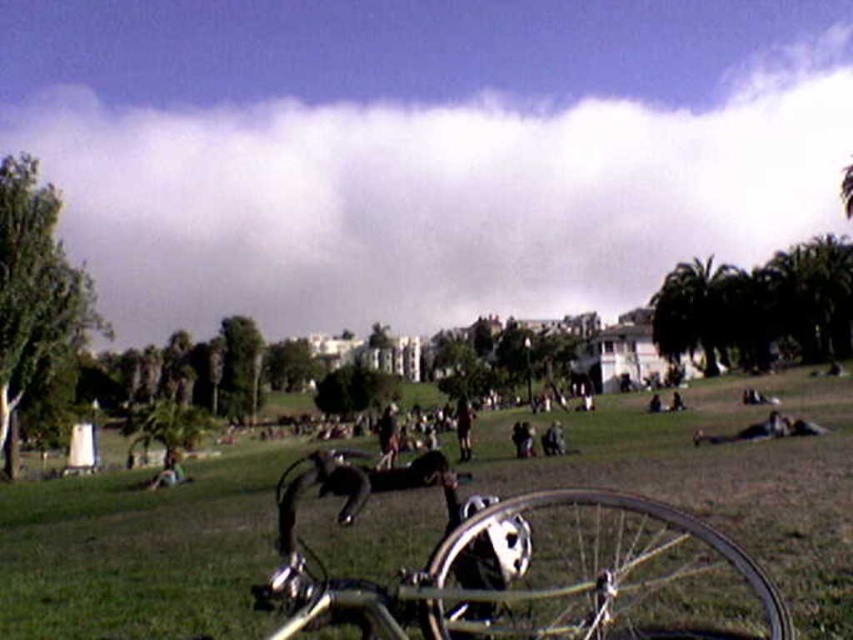
In the scene shown: You are standing at the entrance of the park and see the shiny metallic bicycle at center. If you walk straight ahead, will you reach the bicycle before the trees in the background?

The shiny metallic bicycle at center is located at point [720,477], which is closer to the entrance than the trees in the background. Therefore, you will reach the bicycle before the trees.

You are planning to ride both the shiny metallic bicycle at center and the silver metallic bicycle at center. Since you need to park them close to each other, what is the minimum distance you should keep between them to ensure they don not touch?

The shiny metallic bicycle at center and the silver metallic bicycle at center are 15.24 meters apart, so the minimum distance you should keep between them to ensure they do not touch is 15.24 meters.

You are standing at the point marked by the coordinates point at (834, 547). You want to walk to the nearest tree in the background. How far will you have to walk?

The distance between you and the nearest tree is 22.41 meters, so you will have to walk 22.41 meters to reach it.